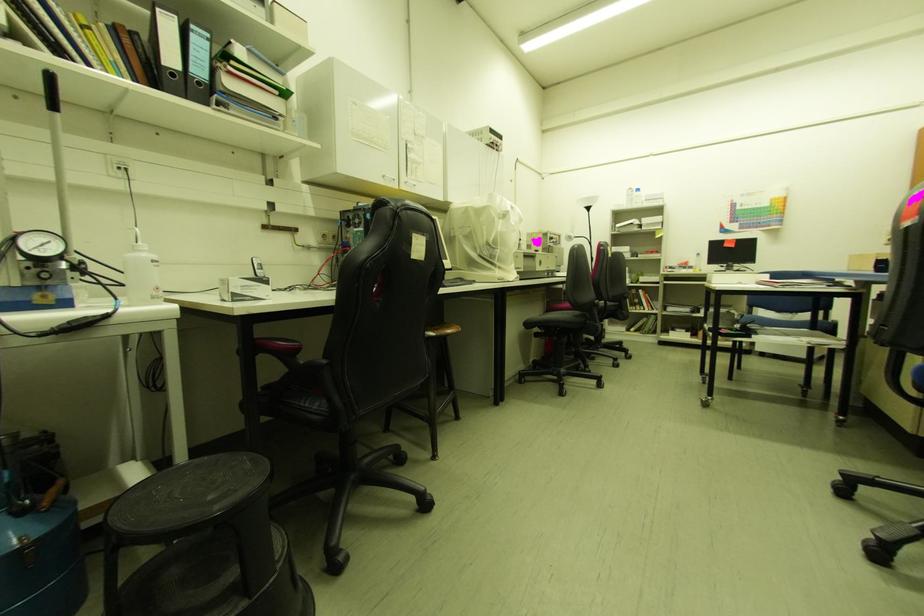
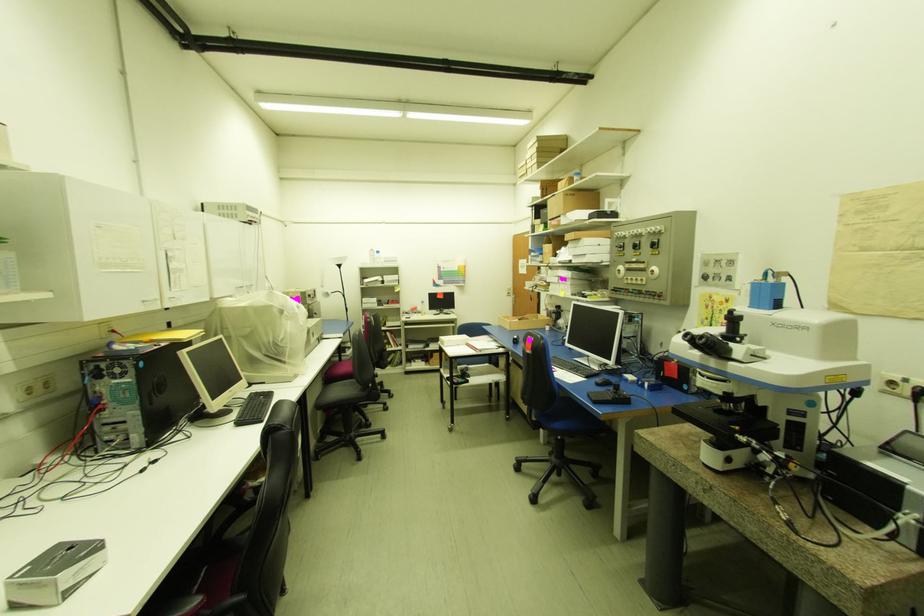
Question: The first image is from the beginning of the video and the second image is from the end. How did the camera likely rotate when shooting the video?

Choices:
 (A) Left
 (B) Right
 (C) Up
 (D) Down

Answer: (B)